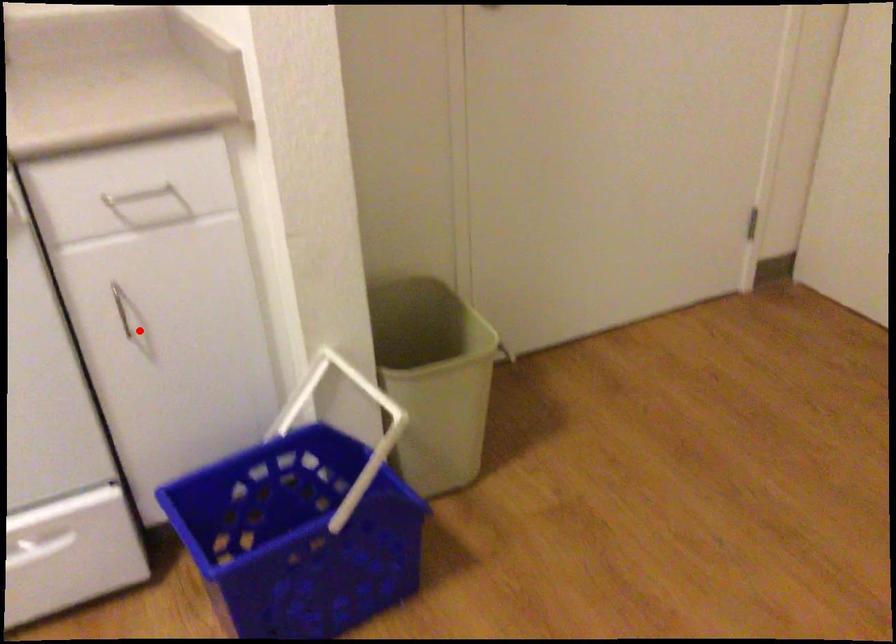
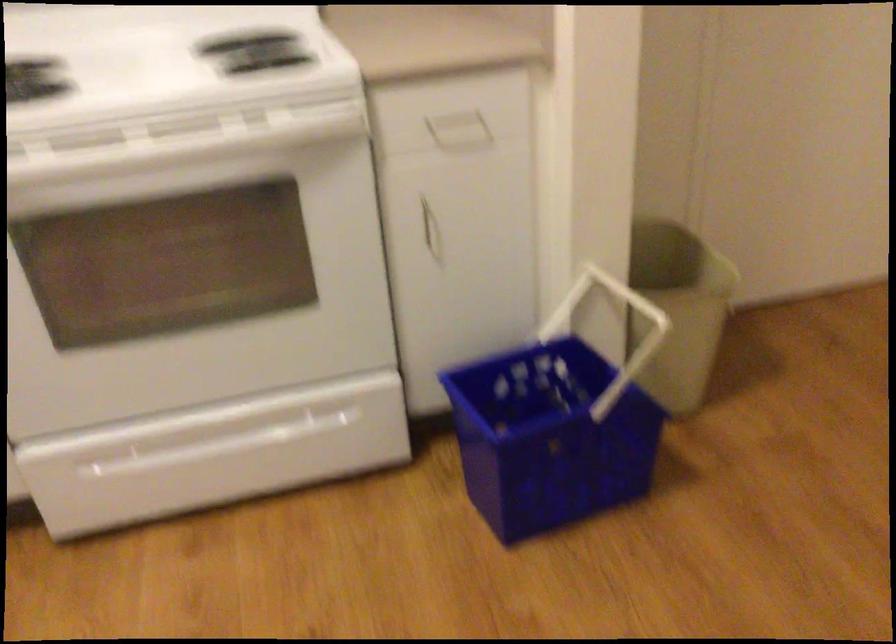
Where in the second image is the point corresponding to the highlighted location from the first image?

(431, 234)